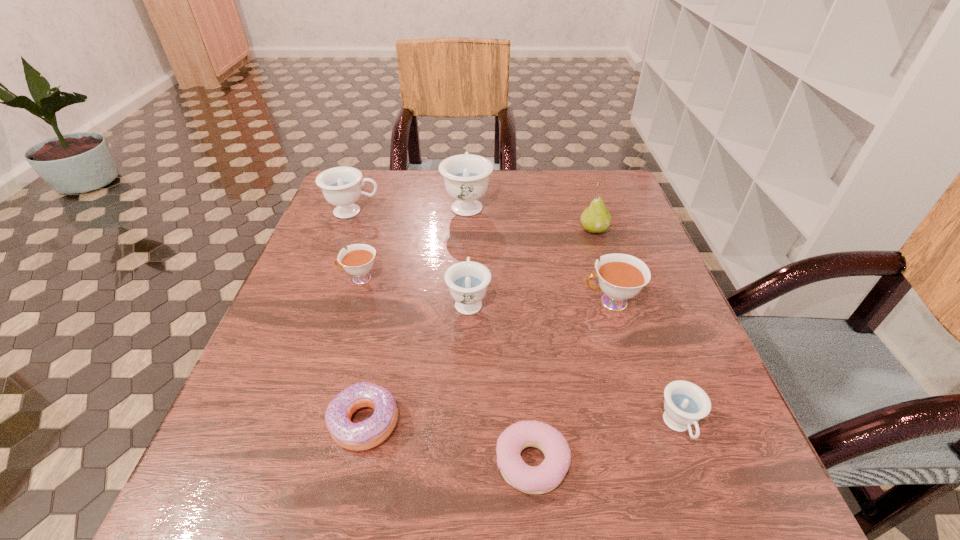
You are a GUI agent. You are given a task and a screenshot of the screen. Output one action in this format:
    pyautogui.click(x=<x>, y=<y>)
    Task: Click on the vacant position located on the side of the smaller white teacup with the handle
    The height and width of the screenshot is (540, 960).
    Given the screenshot: What is the action you would take?
    pyautogui.click(x=299, y=279)

You are a GUI agent. You are given a task and a screenshot of the screen. Output one action in this format:
    pyautogui.click(x=<x>, y=<y>)
    Task: Click on the free region located 0.080m on the side of the smallest blue teacup with the handle
    
    Given the screenshot: What is the action you would take?
    pyautogui.click(x=708, y=508)

At what (x,y) coordinates should I click in order to perform the action: click on vacant area located on the right of the left purple doughnut. Please return your answer as a coordinate pair (x, y). The image size is (960, 540). Looking at the image, I should click on (540, 422).

You are a GUI agent. You are given a task and a screenshot of the screen. Output one action in this format:
    pyautogui.click(x=<x>, y=<y>)
    Task: Click on the free region located 0.090m on the right of the right doughnut
    This screenshot has height=540, width=960.
    Given the screenshot: What is the action you would take?
    pyautogui.click(x=628, y=462)

Where is `object located at the near edge`? This screenshot has height=540, width=960. object located at the near edge is located at coordinates (541, 479).

Identify the location of pear that is at the right edge. This screenshot has width=960, height=540. (596, 218).

Locate an element on the screen. The height and width of the screenshot is (540, 960). object that is at the far left corner is located at coordinates (341, 187).

In the image, there is a desktop. What are the coordinates of `vacant space at the far edge` in the screenshot? It's located at (524, 171).

Identify the location of vacant space at the left edge of the desktop. [x=237, y=455].

Image resolution: width=960 pixels, height=540 pixels. In order to click on vacant space at the right edge of the desktop in this screenshot , I will do click(x=602, y=243).